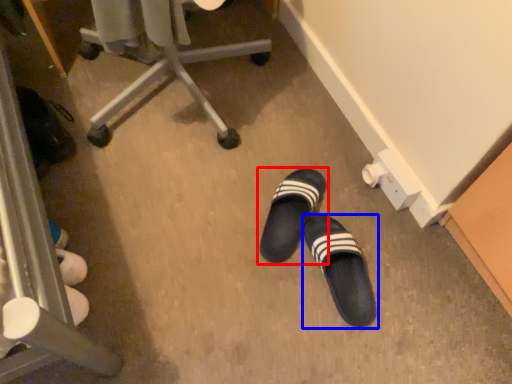
Question: Which object appears farthest to the camera in this image, footwear (highlighted by a red box) or footwear (highlighted by a blue box)?

Choices:
 (A) footwear
 (B) footwear

Answer: (A)